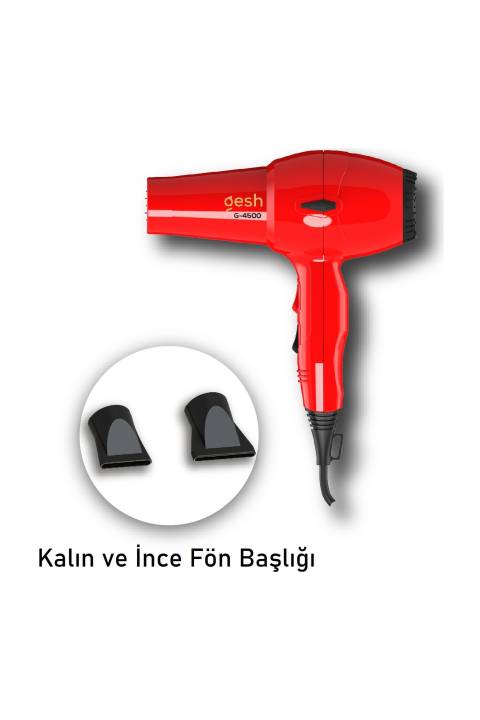
The height and width of the screenshot is (720, 480). In order to click on hairdryer handle in this screenshot , I will do `click(331, 340)`.